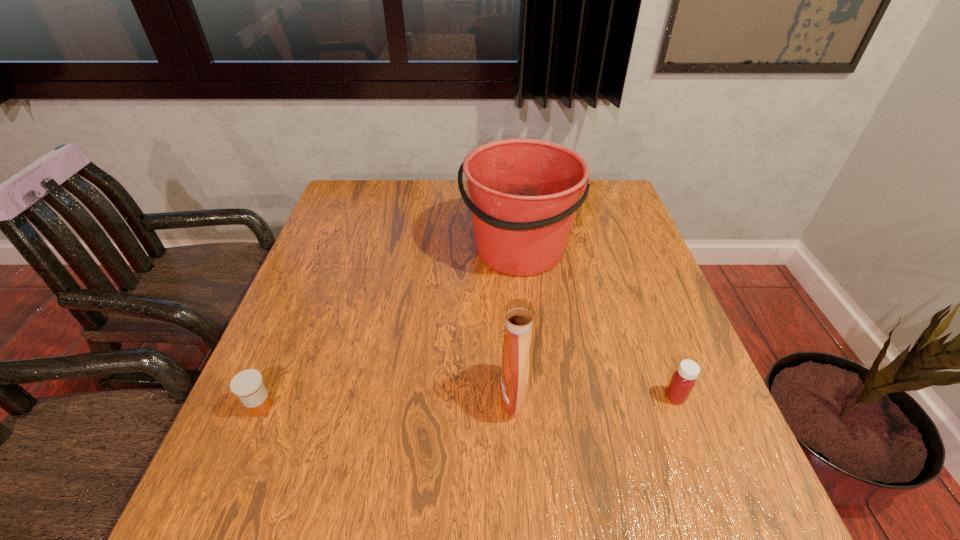
Locate which object is the closest to the detergent. Please provide its 2D coordinates. Your answer should be formatted as a tuple, i.e. [(x, y)], where the tuple contains the x and y coordinates of a point satisfying the conditions above.

[(524, 193)]

This screenshot has height=540, width=960. I want to click on vacant position in the image that satisfies the following two spatial constraints: 1. on the front-facing side of the detergent; 2. on the label of the left medicine, so click(x=514, y=407).

The height and width of the screenshot is (540, 960). What are the coordinates of `vacant position in the image that satisfies the following two spatial constraints: 1. on the front-facing side of the detergent; 2. on the left side of the rightmost object` in the screenshot? It's located at (513, 396).

This screenshot has width=960, height=540. In order to click on blank space that satisfies the following two spatial constraints: 1. on the front-facing side of the detergent; 2. on the label of the leftmost object in this screenshot , I will do `click(514, 407)`.

What are the coordinates of `free space that satisfies the following two spatial constraints: 1. on the back side of the rightmost object; 2. on the front-facing side of the detergent` in the screenshot? It's located at (x=675, y=395).

Find the location of a particular element. This screenshot has width=960, height=540. vacant area in the image that satisfies the following two spatial constraints: 1. on the front-facing side of the detergent; 2. on the label of the left medicine is located at coordinates (514, 407).

Locate an element on the screen. The width and height of the screenshot is (960, 540). blank space that satisfies the following two spatial constraints: 1. on the back side of the rightmost object; 2. on the front-facing side of the detergent is located at coordinates (675, 395).